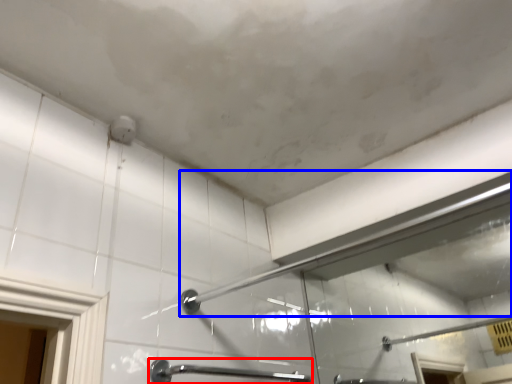
Question: Which point is further to the camera, door handle (highlighted by a red box) or shower (highlighted by a blue box)?

Choices:
 (A) door handle
 (B) shower

Answer: (A)